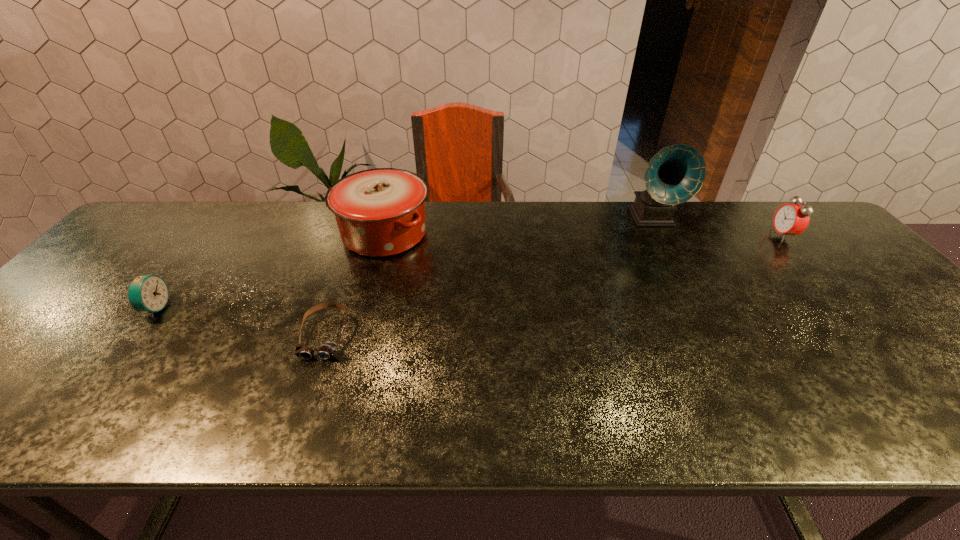
You are a GUI agent. You are given a task and a screenshot of the screen. Output one action in this format:
    pyautogui.click(x=<x>, y=<y>)
    Task: Click on the free space that satisfies the following two spatial constraints: 1. from the horn of the phonograph_record; 2. on the front-facing side of the shorter alarm clock
    
    Given the screenshot: What is the action you would take?
    pyautogui.click(x=699, y=308)

The height and width of the screenshot is (540, 960). Identify the location of free location that satisfies the following two spatial constraints: 1. on the front side of the casserole; 2. on the front-facing side of the leftmost object. (364, 308).

At what (x,y) coordinates should I click in order to perform the action: click on vacant area in the image that satisfies the following two spatial constraints: 1. on the front-facing side of the farther alarm clock; 2. on the front-facing side of the goggles. Please return your answer as a coordinate pair (x, y). This screenshot has width=960, height=540. Looking at the image, I should click on (870, 335).